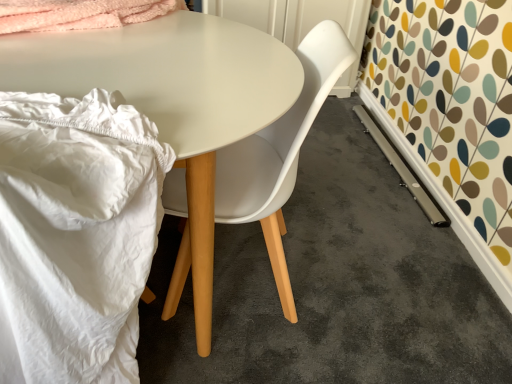
Locate an element on the screen. This screenshot has width=512, height=384. white glossy table at center is located at coordinates (172, 99).

This screenshot has height=384, width=512. What are the coordinates of `white fabric at left` in the screenshot? It's located at (75, 234).

This screenshot has height=384, width=512. Find the location of `white glossy table at center`. white glossy table at center is located at coordinates (172, 99).

Which object is further away from the camera, white fabric at left or white glossy table at center?

white glossy table at center is further from the camera.

Is point (71, 254) less distant than point (227, 118)?

Yes, it is.

Which object is positioned more to the left, white fabric at left or white glossy table at center?

white fabric at left is more to the left.

Is white fabric at left placed right next to white glossy table at center?

No, white fabric at left is not next to white glossy table at center.

From the image's perspective, is white plastic chair at center located above or below white fabric at left?

white plastic chair at center is above white fabric at left.

From a real-world perspective, between white plastic chair at center and white fabric at left, who is vertically lower?

In real-world perspective, white plastic chair at center is lower.

Are white plastic chair at center and white fabric at left located far from each other?

white plastic chair at center is actually quite close to white fabric at left.

Which is correct: white plastic chair at center is inside white fabric at left, or outside of it?

white plastic chair at center exists outside the volume of white fabric at left.

Is white fabric at left turned away from white plastic chair at center?

No, white plastic chair at center is not at the back of white fabric at left.

From a real-world perspective, is white fabric at left positioned under white plastic chair at center based on gravity?

No, from a real-world perspective, white fabric at left is not beneath white plastic chair at center.

Is white fabric at left far away from white plastic chair at center?

Actually, white fabric at left and white plastic chair at center are a little close together.

Between point (59, 343) and point (313, 69), which one is positioned in front?

The point (59, 343) is closer to the camera.

Is point (240, 138) closer to viewer compared to point (28, 98)?

Yes, it is in front of point (28, 98).

From a real-world perspective, between white glossy table at center and white fabric at left, who is vertically higher?

From a 3D spatial view, white fabric at left is above.

Considering the relative sizes of white glossy table at center and white fabric at left in the image provided, is white glossy table at center bigger than white fabric at left?

Correct, white glossy table at center is larger in size than white fabric at left.

Is white plastic chair at center surrounded by white glossy table at center?

Yes, white plastic chair at center is a part of white glossy table at center.

Is white glossy table at center oriented away from white plastic chair at center?

That's not correct — white glossy table at center is not looking away from white plastic chair at center.

Which is in front, point (133, 94) or point (274, 150)?

Positioned in front is point (133, 94).

Between white plastic chair at center and white glossy table at center, which one has less height?

white glossy table at center.

Is white plastic chair at center positioned with its back to white glossy table at center?

Yes, white plastic chair at center is positioned with its back facing white glossy table at center.

Between point (313, 70) and point (217, 101), which one is positioned behind?

The point (313, 70) is more distant.

Image resolution: width=512 pixels, height=384 pixels. I want to click on table on the right of white fabric at left, so click(172, 99).

Where is `chair that appears above the white fabric at left (from the image's perspective)`? chair that appears above the white fabric at left (from the image's perspective) is located at coordinates (279, 153).

Looking at the image, which one is located closer to white fabric at left, white plastic chair at center or white glossy table at center?

white glossy table at center is closer to white fabric at left.

Based on their spatial positions, is white fabric at left or white plastic chair at center closer to white glossy table at center?

The object closer to white glossy table at center is white plastic chair at center.

Based on their spatial positions, is white fabric at left or white glossy table at center closer to white plastic chair at center?

Based on the image, white glossy table at center appears to be nearer to white plastic chair at center.

Which object lies further to the anchor point white fabric at left, white glossy table at center or white plastic chair at center?

white plastic chair at center is positioned further to the anchor white fabric at left.

Looking at the image, which one is located further to white glossy table at center, white plastic chair at center or white fabric at left?

white fabric at left is positioned further to the anchor white glossy table at center.

Looking at this image, based on their spatial positions, is white glossy table at center or white fabric at left further from white plastic chair at center?

white fabric at left is positioned further to the anchor white plastic chair at center.

Identify the location of table between white fabric at left and white plastic chair at center. The width and height of the screenshot is (512, 384). (172, 99).